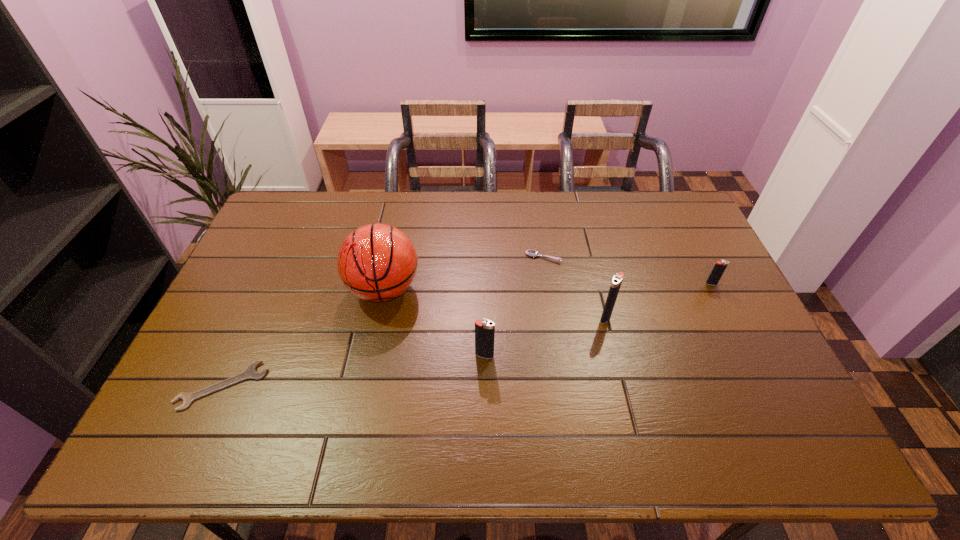
Please point a spot to add another igniter on the left. Please provide its 2D coordinates. Your answer should be formatted as a tuple, i.e. [(x, y)], where the tuple contains the x and y coordinates of a point satisfying the conditions above.

[(343, 400)]